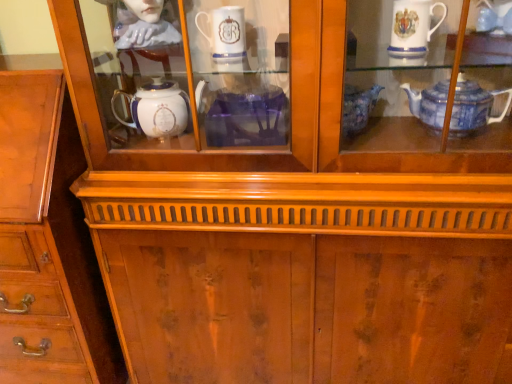
The width and height of the screenshot is (512, 384). Describe the element at coordinates (48, 244) in the screenshot. I see `wooden chest of drawers at left` at that location.

Find the location of a particular element. Image resolution: width=512 pixels, height=384 pixels. wooden chest of drawers at left is located at coordinates point(48,244).

In the scene shown: In order to face wooden chest of drawers at left, should I rotate leftwards or rightwards?

A 31.026 degree turn to the left will do.

The image size is (512, 384). What are the coordinates of `wooden chest of drawers at left` in the screenshot? It's located at (48, 244).